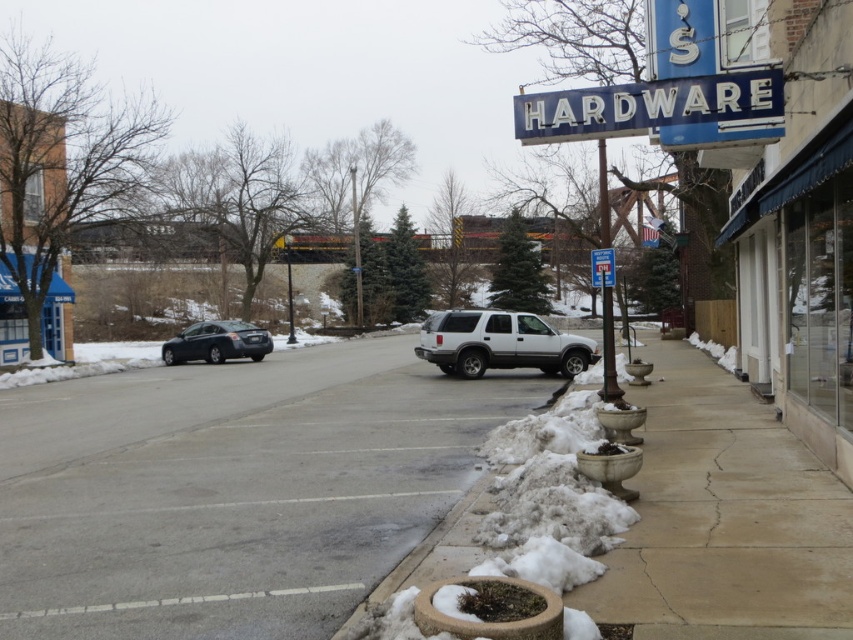
You are a delivery person trying to park your truck next to the silver metallic suv at center. The truck is wider than the suv. Based on the scene, can you estimate if the blue metallic sign at upper center has enough space to accommodate the truck without overlapping the suv?

The blue metallic sign at upper center has a width less than the silver metallic suv at center, so the truck, which is wider than the suv, might not have enough space if it tries to park next to the suv without overlapping.

You are a delivery person trying to park your delivery van, which is 6 meters long, in the parking spot between the gray asphalt pavement at center and the silver metallic suv at center. Based on the scene, can your van fit in the available space?

The gray asphalt pavement at center occupies less space than the silver metallic suv at center, so the parking space between them is likely too small to accommodate a 6 meter long delivery van.